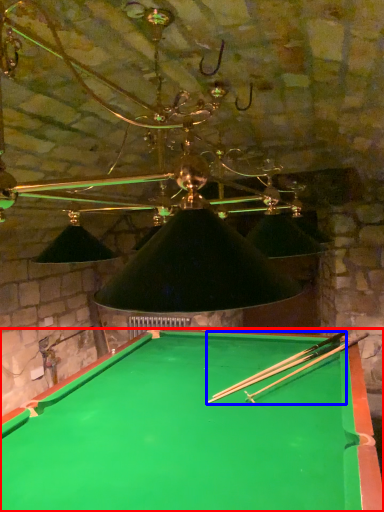
Question: Which of the following is the farthest to the observer, billiard table (highlighted by a red box) or cue (highlighted by a blue box)?

Choices:
 (A) billiard table
 (B) cue

Answer: (B)